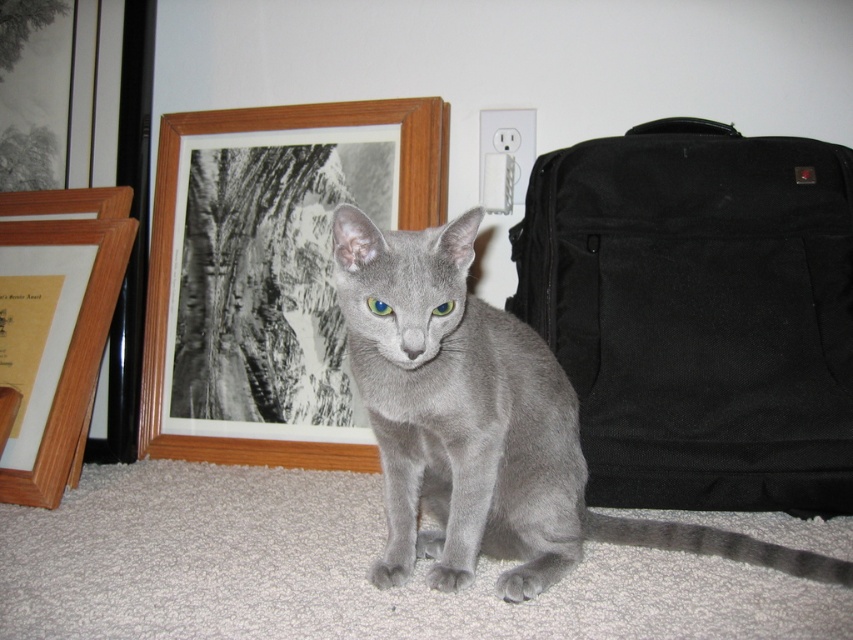
You are packing for a trip and need to place your gray matte fur cat at center into the black canvas suitcase at right. Can the cat fit inside the suitcase based on their positions?

The black canvas suitcase at right is located above the gray matte fur cat at center, so the cat cannot fit inside the suitcase since it is positioned below the suitcase.

You are moving and need to check if your cat can reach the electrical outlet behind it. Based on the scene, is the gray matte fur cat at center positioned between the black canvas suitcase at right and the white electrical outlet?

The black canvas suitcase at right is to the right of gray matte fur cat at center, so the cat is between the suitcase and the electrical outlet, meaning it can reach the outlet.